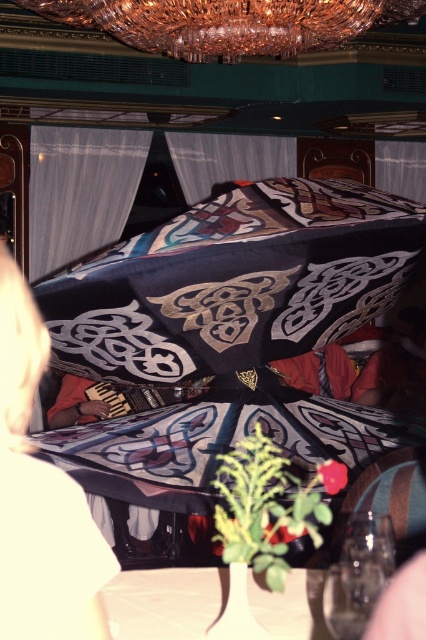
Which is more to the left, silky black umbrella at center or crystal glass chandelier at upper center?

silky black umbrella at center

This screenshot has width=426, height=640. In order to click on silky black umbrella at center in this screenshot , I will do `click(235, 282)`.

The width and height of the screenshot is (426, 640). Describe the element at coordinates (235, 282) in the screenshot. I see `silky black umbrella at center` at that location.

Where is `silky black umbrella at center`? The image size is (426, 640). silky black umbrella at center is located at coordinates (235, 282).

Is silky gray curtain at center to the right of matte black umbrella at lower right from the viewer's perspective?

No, silky gray curtain at center is not to the right of matte black umbrella at lower right.

Is point (258, 173) in front of point (411, 346)?

No, (258, 173) is further to viewer.

Where is `silky gray curtain at center`? Image resolution: width=426 pixels, height=640 pixels. silky gray curtain at center is located at coordinates (227, 160).

Does point (140, 436) come in front of point (16, 22)?

That is True.

Which is more to the right, silky patterned cloth at center or crystal glass chandelier at upper center?

crystal glass chandelier at upper center is more to the right.

The image size is (426, 640). Describe the element at coordinates (218, 444) in the screenshot. I see `silky patterned cloth at center` at that location.

The image size is (426, 640). I want to click on silky patterned cloth at center, so click(218, 444).